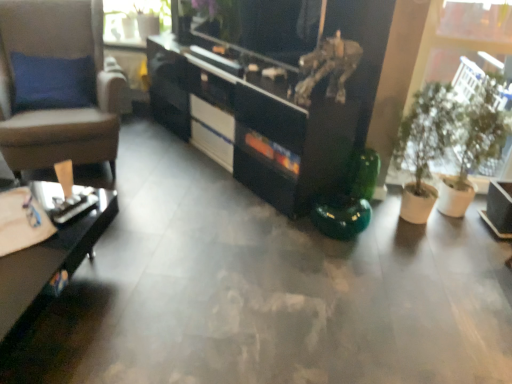
Describe the element at coordinates (47, 102) in the screenshot. This screenshot has width=512, height=384. I see `brown leather chair at left` at that location.

The height and width of the screenshot is (384, 512). What do you see at coordinates (134, 21) in the screenshot?
I see `clear glass vase at upper left` at bounding box center [134, 21].

This screenshot has width=512, height=384. What do you see at coordinates (212, 144) in the screenshot? I see `white glossy drawer at center` at bounding box center [212, 144].

Image resolution: width=512 pixels, height=384 pixels. Identify the location of brown leather chair at left. (47, 102).

Does green matte plant at right have a greater height compared to white glossy drawer at center?

Correct, green matte plant at right is much taller as white glossy drawer at center.

Locate an element on the screen. This screenshot has width=512, height=384. houseplant located in front of the white glossy drawer at center is located at coordinates (448, 139).

Consider the image. Is green matte plant at right at the right side of white glossy drawer at center?

Yes, green matte plant at right is to the right of white glossy drawer at center.

How different are the orientations of green matte plant at right and white glossy drawer at center in degrees?

The angle between the facing direction of green matte plant at right and the facing direction of white glossy drawer at center is 39.1 degrees.

Does point (28, 140) appear closer or farther from the camera than point (467, 113)?

Point (28, 140) is farther from the camera than point (467, 113).

From the picture: Considering the relative positions of brown leather chair at left and green matte plant at right in the image provided, is brown leather chair at left to the left or to the right of green matte plant at right?

From the image, it's evident that brown leather chair at left is to the left of green matte plant at right.

Is brown leather chair at left situated inside green matte plant at right or outside?

brown leather chair at left is outside green matte plant at right.

This screenshot has width=512, height=384. Find the location of `chair above the green matte plant at right (from the image's perspective)`. chair above the green matte plant at right (from the image's perspective) is located at coordinates (47, 102).

The width and height of the screenshot is (512, 384). I want to click on desk below the green matte plant at right (from the image's perspective), so click(51, 260).

Is green matte plant at right oriented towards black glossy desk at lower left?

No, green matte plant at right is not aimed at black glossy desk at lower left.

From a real-world perspective, is green matte plant at right located beneath black glossy desk at lower left?

No, from a real-world perspective, green matte plant at right is not under black glossy desk at lower left.

From the picture: Considering the positions of objects green matte plant at right and black glossy desk at lower left in the image provided, who is more to the left, green matte plant at right or black glossy desk at lower left?

black glossy desk at lower left is more to the left.

Is black glossy desk at lower left at the back of white glossy drawer at center?

That's not correct — white glossy drawer at center is not looking away from black glossy desk at lower left.

From the picture: Can you confirm if white glossy drawer at center is bigger than black glossy desk at lower left?

No, white glossy drawer at center is not bigger than black glossy desk at lower left.

This screenshot has width=512, height=384. Find the location of `drawer below the black glossy desk at lower left (from a real-world perspective)`. drawer below the black glossy desk at lower left (from a real-world perspective) is located at coordinates (212, 144).

Between white glossy drawer at center and black glossy desk at lower left, which one has smaller width?

With smaller width is white glossy drawer at center.

Is point (486, 85) closer or farther from the camera than point (173, 90)?

Point (486, 85).

From a real-world perspective, which is physically above, green matte plant at right or black glossy cabinet at center?

From a 3D spatial view, green matte plant at right is above.

Is green matte plant at right not within black glossy cabinet at center?

Yes, green matte plant at right is located beyond the bounds of black glossy cabinet at center.

Is green matte plant at right taller than black glossy cabinet at center?

Indeed, green matte plant at right has a greater height compared to black glossy cabinet at center.

Consider the image. From the image's perspective, between clear glass vase at upper left and white glossy drawer at center, which one is located above?

From the image's view, clear glass vase at upper left is above.

From a real-world perspective, between clear glass vase at upper left and white glossy drawer at center, who is vertically higher?

clear glass vase at upper left, from a real-world perspective.

Is clear glass vase at upper left aimed at white glossy drawer at center?

No, clear glass vase at upper left is not facing towards white glossy drawer at center.

Looking at the image, does clear glass vase at upper left seem bigger or smaller compared to white glossy drawer at center?

Clearly, clear glass vase at upper left is larger in size than white glossy drawer at center.

Is white glossy drawer at center shorter than black glossy cabinet at center?

Yes, white glossy drawer at center is shorter than black glossy cabinet at center.

In terms of width, does white glossy drawer at center look wider or thinner when compared to black glossy cabinet at center?

In the image, white glossy drawer at center appears to be more narrow than black glossy cabinet at center.

Is white glossy drawer at center next to black glossy cabinet at center?

white glossy drawer at center and black glossy cabinet at center are not in contact.

Locate an element on the screen. The image size is (512, 384). houseplant that is below the white glossy drawer at center (from the image's perspective) is located at coordinates (448, 139).

You are a GUI agent. You are given a task and a screenshot of the screen. Output one action in this format:
    pyautogui.click(x=<x>, y=<y>)
    Task: Click on the houseplant lying behind the brown leather chair at left
    
    Given the screenshot: What is the action you would take?
    pyautogui.click(x=448, y=139)

Which object lies nearer to the anchor point black glossy desk at lower left, white glossy drawer at center or brown leather chair at left?

brown leather chair at left.

Based on their spatial positions, is green matte plant at right or brown leather chair at left further from white glossy drawer at center?

green matte plant at right.

Which object lies further to the anchor point black glossy desk at lower left, clear glass vase at upper left or green matte plant at right?

clear glass vase at upper left.

Estimate the real-world distances between objects in this image. Which object is closer to green matte plant at right, brown leather chair at left or clear glass vase at upper left?

brown leather chair at left is positioned closer to the anchor green matte plant at right.

Looking at the image, which one is located closer to black glossy cabinet at center, white glossy drawer at center or black glossy desk at lower left?

white glossy drawer at center.

When comparing their distances from green matte plant at right, does clear glass vase at upper left or black glossy desk at lower left seem closer?

black glossy desk at lower left is closer to green matte plant at right.

Considering their positions, is black glossy desk at lower left positioned closer to green matte plant at right than black glossy cabinet at center?

black glossy cabinet at center is positioned closer to the anchor green matte plant at right.

When comparing their distances from black glossy desk at lower left, does clear glass vase at upper left or brown leather chair at left seem closer?

Based on the image, brown leather chair at left appears to be nearer to black glossy desk at lower left.

Where is `cabinetry situated between white glossy drawer at center and green matte plant at right from left to right`? cabinetry situated between white glossy drawer at center and green matte plant at right from left to right is located at coordinates (279, 91).

The image size is (512, 384). What are the coordinates of `desk situated between brown leather chair at left and green matte plant at right from left to right` in the screenshot? It's located at (51, 260).

Identify the location of chair between black glossy desk at lower left and white glossy drawer at center from front to back. This screenshot has width=512, height=384. coord(47,102).

You are a GUI agent. You are given a task and a screenshot of the screen. Output one action in this format:
    pyautogui.click(x=<x>, y=<y>)
    Task: Click on the drawer between brown leather chair at left and black glossy cabinet at center from left to right
    Image resolution: width=512 pixels, height=384 pixels.
    Given the screenshot: What is the action you would take?
    pyautogui.click(x=212, y=144)